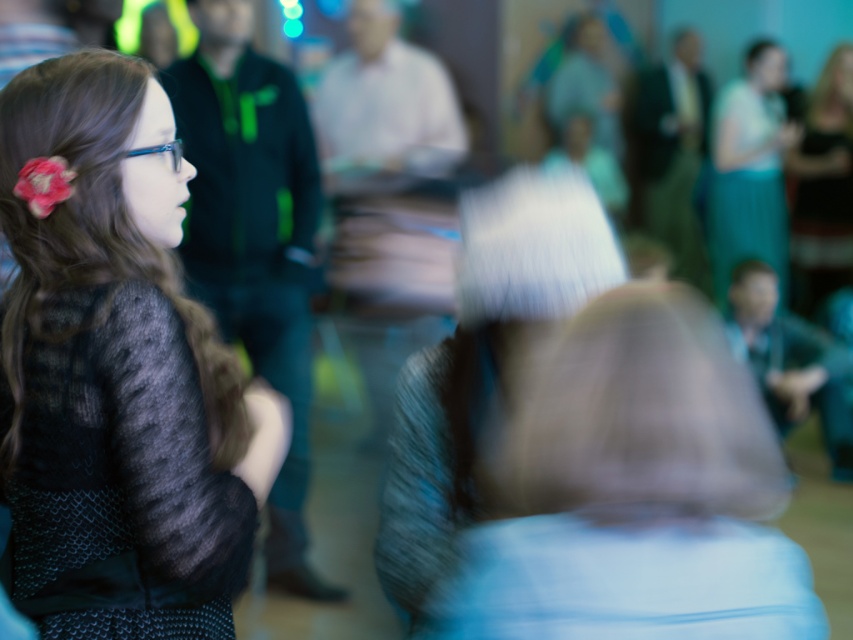
You are organizing a charity event and need to decide which clothing items to display first. You have a knitted sweater at left and a dark brown leather jacket at upper right. Based on their sizes, which one should you place on the smaller display stand?

The knitted sweater at left has a smaller width than the dark brown leather jacket at upper right, so it should be placed on the smaller display stand.

You are a photographer who wants to adjust the camera focus to capture both the teal fabric dress at upper right and the dark brown leather jacket at upper right clearly. Based on their positions, which object should you focus on first to ensure both are in focus?

The teal fabric dress at upper right is not as tall as dark brown leather jacket at upper right. To capture both clearly, focus on the dark brown leather jacket at upper right first since it is taller and likely farther away, ensuring the depth of field includes both.

You are a photographer who wants to adjust the focus on the knitted sweater at left and the teal fabric dress at upper right. Which object should you focus on first if you want to capture both in sharp detail?

The knitted sweater at left is located below the teal fabric dress at upper right. Since the knitted sweater at left is closer to the camera than the teal fabric dress at upper right, focusing on the knitted sweater at left first would allow you to adjust the focus to include both objects in sharp detail.